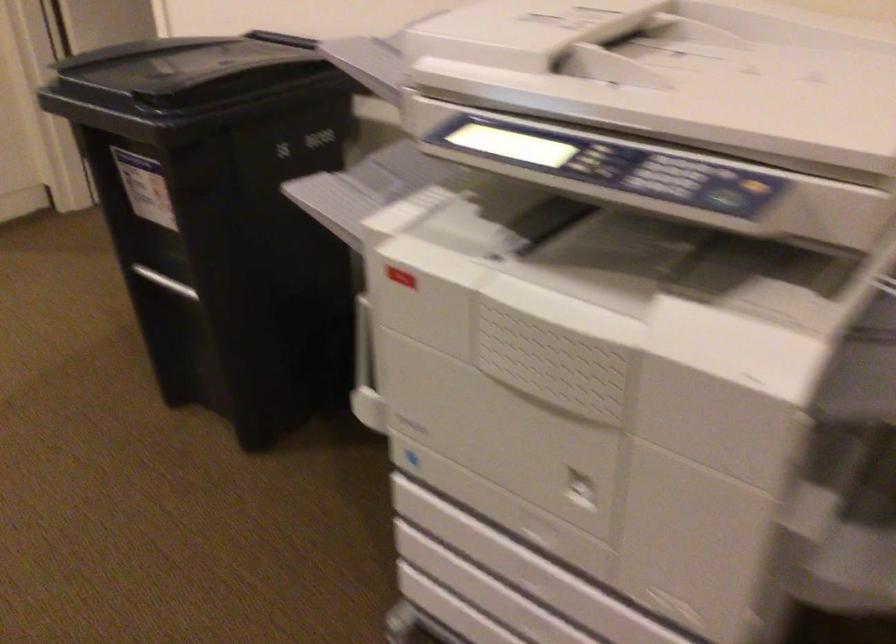
Describe the element at coordinates (165, 281) in the screenshot. I see `the black trash bin handle` at that location.